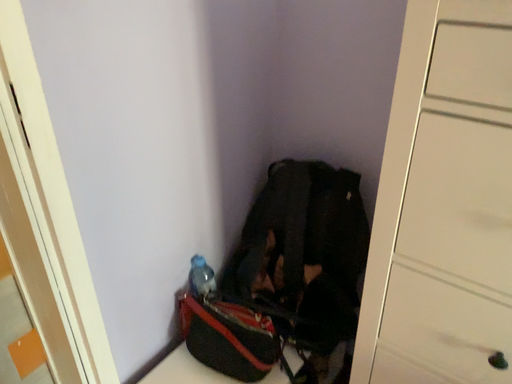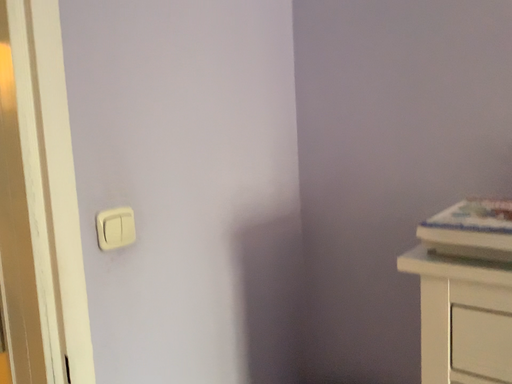
Question: How did the camera likely rotate when shooting the video?

Choices:
 (A) rotated downward
 (B) rotated upward

Answer: (B)